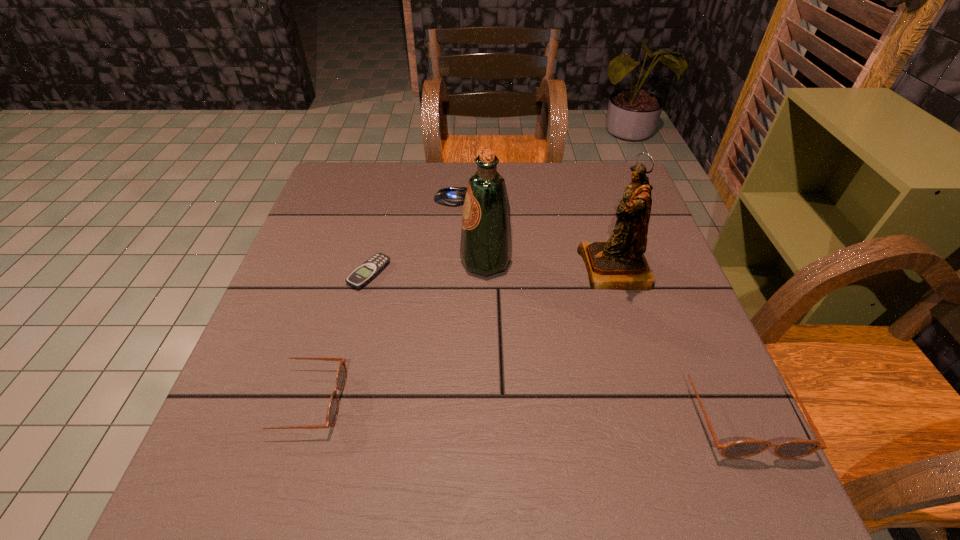
This screenshot has width=960, height=540. I want to click on the left sunglasses, so click(x=332, y=412).

The image size is (960, 540). I want to click on the third shortest object, so click(332, 412).

You are a GUI agent. You are given a task and a screenshot of the screen. Output one action in this format:
    pyautogui.click(x=<x>, y=<y>)
    Task: Click on the third tallest object
    The width and height of the screenshot is (960, 540).
    Given the screenshot: What is the action you would take?
    pyautogui.click(x=793, y=449)

I want to click on the taller sunglasses, so click(x=793, y=449).

Image resolution: width=960 pixels, height=540 pixels. In order to click on the farthest object in this screenshot , I will do `click(451, 196)`.

At what (x,y) coordinates should I click in order to perform the action: click on computer mouse. Please return your answer as a coordinate pair (x, y). Looking at the image, I should click on (451, 196).

Locate an element on the screen. The width and height of the screenshot is (960, 540). figurine is located at coordinates (618, 264).

The image size is (960, 540). I want to click on olive oil, so click(486, 245).

Locate an element on the screen. Image resolution: width=960 pixels, height=540 pixels. the shortest object is located at coordinates (x=365, y=273).

Locate an element on the screen. The image size is (960, 540). blank space located 0.060m on the front-facing side of the third shortest object is located at coordinates (375, 400).